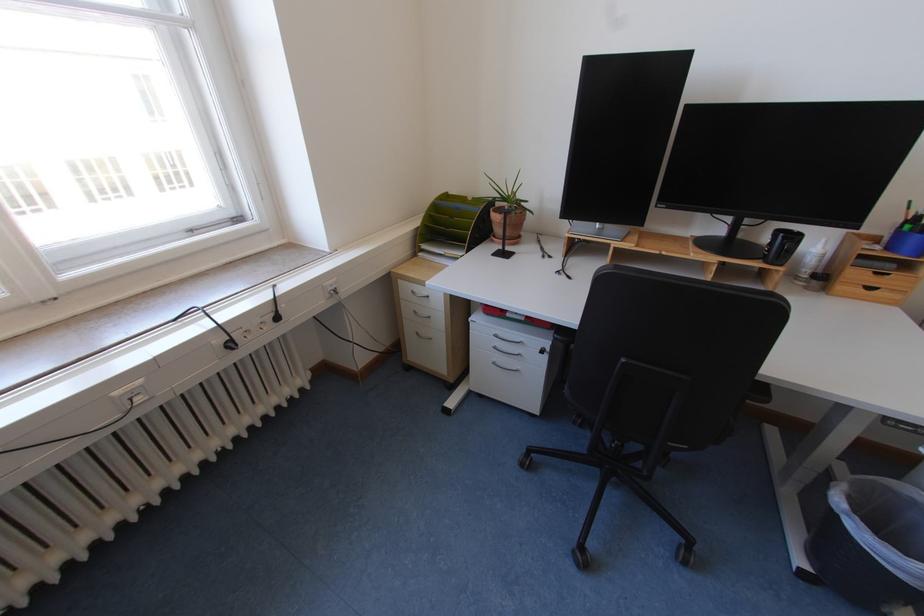
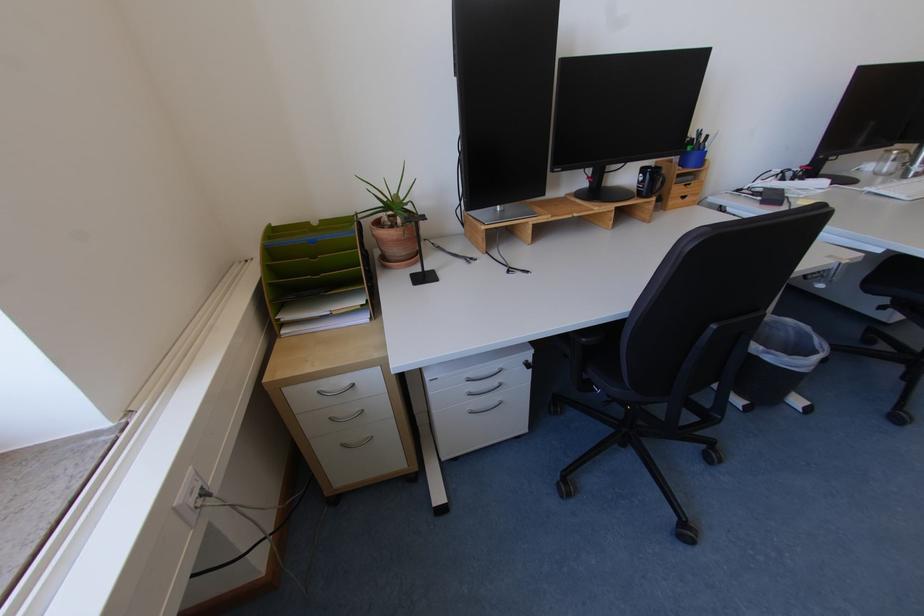
Find the pixel in the second image that matches (331,286) in the first image.

(181, 509)